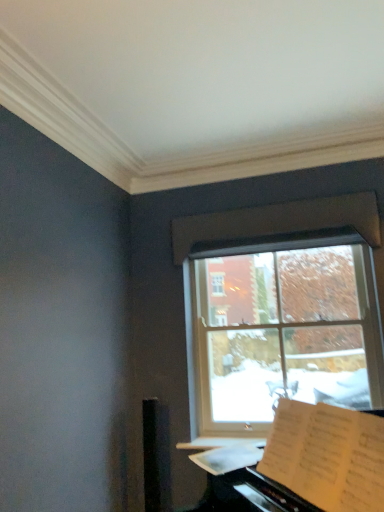
Question: Can you confirm if clear glass window at center is bigger than white paper at lower right?

Choices:
 (A) no
 (B) yes

Answer: (A)

Question: Is clear glass window at center to the left of white paper at lower right from the viewer's perspective?

Choices:
 (A) no
 (B) yes

Answer: (B)

Question: Does clear glass window at center have a greater width compared to white paper at lower right?

Choices:
 (A) no
 (B) yes

Answer: (A)

Question: Is white paper at lower right surrounded by clear glass window at center?

Choices:
 (A) no
 (B) yes

Answer: (A)

Question: Is clear glass window at center outside white paper at lower right?

Choices:
 (A) yes
 (B) no

Answer: (A)

Question: From a real-world perspective, is clear glass window at center positioned under white paper at lower right based on gravity?

Choices:
 (A) no
 (B) yes

Answer: (A)

Question: From the image's perspective, would you say white paper at lower right is positioned over white paper sheet music at lower right?

Choices:
 (A) yes
 (B) no

Answer: (A)

Question: Does white paper at lower right turn towards white paper sheet music at lower right?

Choices:
 (A) no
 (B) yes

Answer: (B)

Question: Does white paper at lower right appear on the left side of white paper sheet music at lower right?

Choices:
 (A) yes
 (B) no

Answer: (B)

Question: Can you confirm if white paper at lower right is taller than white paper sheet music at lower right?

Choices:
 (A) yes
 (B) no

Answer: (A)

Question: From a real-world perspective, is white paper at lower right physically above white paper sheet music at lower right?

Choices:
 (A) no
 (B) yes

Answer: (A)

Question: Is white paper at lower right positioned beyond the bounds of white paper sheet music at lower right?

Choices:
 (A) no
 (B) yes

Answer: (B)

Question: Does clear glass window at center lie in front of white paper sheet music at lower right?

Choices:
 (A) no
 (B) yes

Answer: (A)